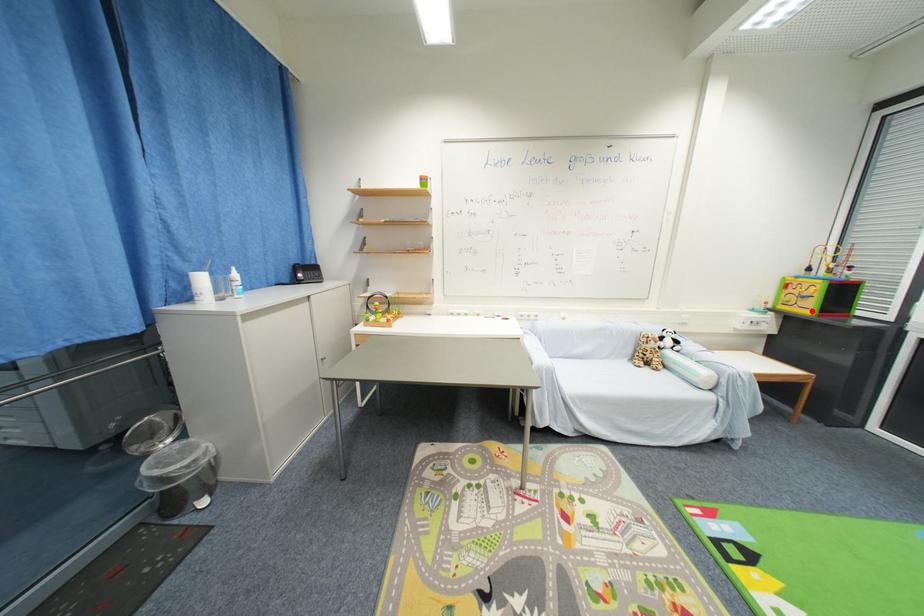
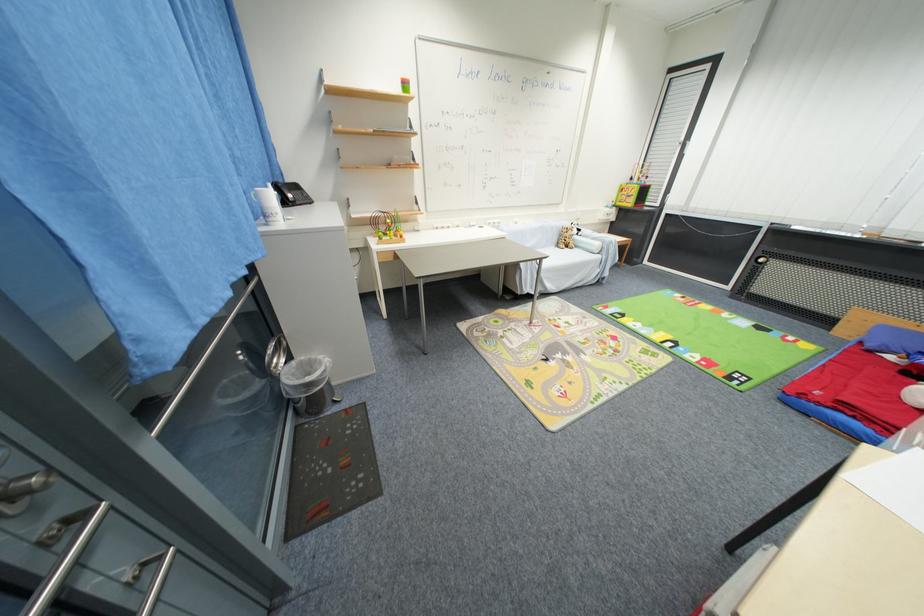
Question: I am providing you with two images of the same scene from different viewpoints. A red point is shown in image1. For the corresponding object point in image2, is it positioned nearer or farther from the camera?

Choices:
 (A) Nearer
 (B) Farther

Answer: (A)